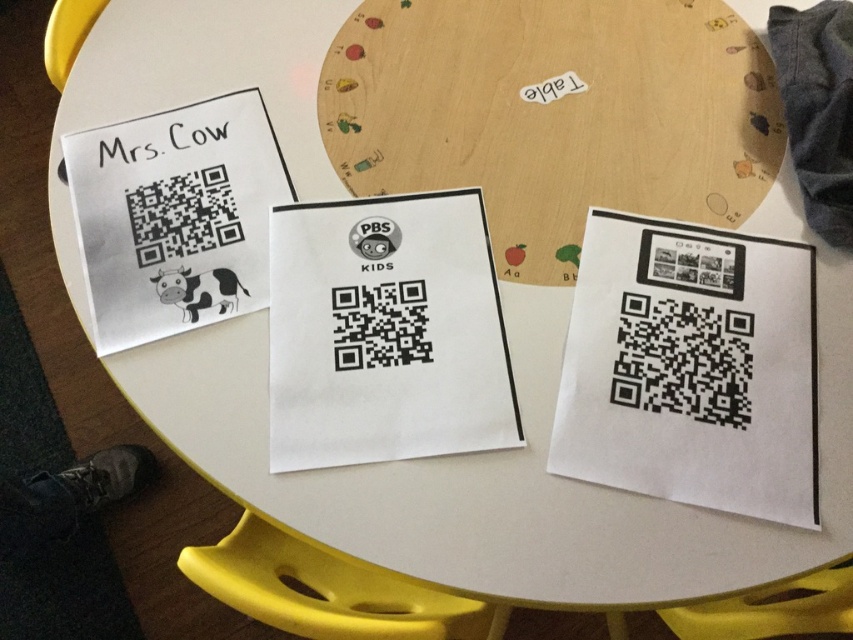
Which is above, white paper qr code at upper left or yellow plastic chair at lower left?

white paper qr code at upper left is above.

Measure the distance between point (x=231, y=244) and camera.

Point (x=231, y=244) is 79.84 centimeters away from camera.

The width and height of the screenshot is (853, 640). Identify the location of white paper qr code at upper left. (175, 216).

Is white paper qr code at upper left thinner than black paper at upper left?

In fact, white paper qr code at upper left might be wider than black paper at upper left.

Who is more distant from viewer, (254, 163) or (210, 131)?

The point (210, 131) is behind.

You are a GUI agent. You are given a task and a screenshot of the screen. Output one action in this format:
    pyautogui.click(x=<x>, y=<y>)
    Task: Click on the white paper qr code at upper left
    
    Given the screenshot: What is the action you would take?
    pyautogui.click(x=175, y=216)

Looking at this image, does yellow plastic chair at lower center appear under black paper at upper left?

Yes, yellow plastic chair at lower center is below black paper at upper left.

Locate an element on the screen. yellow plastic chair at lower center is located at coordinates (770, 611).

Is point (791, 621) positioned behind point (152, 140)?

No, it is in front of (152, 140).

In order to click on yellow plastic chair at lower center in this screenshot , I will do `click(770, 611)`.